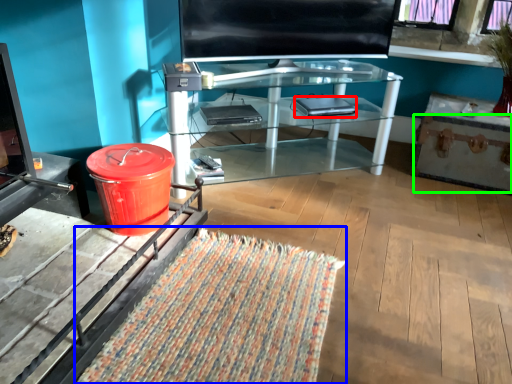
Question: Which is farther away from laptop (highlighted by a red box)? mat (highlighted by a blue box) or drawer (highlighted by a green box)?

Choices:
 (A) mat
 (B) drawer

Answer: (A)